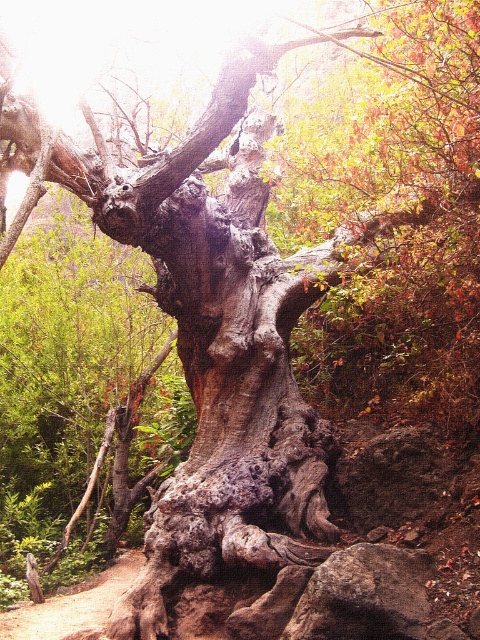
Question: Which of the following is the farthest from the observer?

Choices:
 (A) (332, 625)
 (B) (67, 634)

Answer: (B)

Question: From the image, what is the correct spatial relationship of gray rough rock at lower right in relation to brown dirt trail at lower left?

Choices:
 (A) left
 (B) right

Answer: (B)

Question: Does gray rough rock at lower right appear on the left side of brown dirt trail at lower left?

Choices:
 (A) yes
 (B) no

Answer: (B)

Question: Does gray rough rock at lower right lie in front of brown dirt trail at lower left?

Choices:
 (A) yes
 (B) no

Answer: (A)